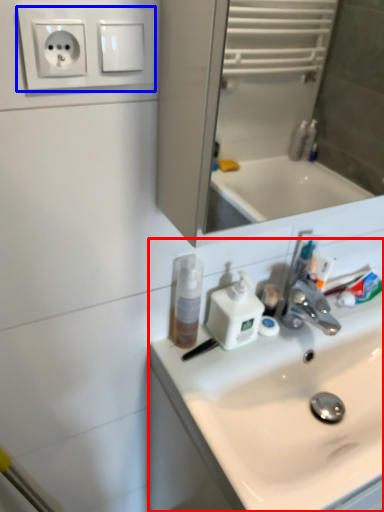
Question: Which of the following is the closest to the observer, sink (highlighted by a red box) or electric outlet (highlighted by a blue box)?

Choices:
 (A) sink
 (B) electric outlet

Answer: (B)